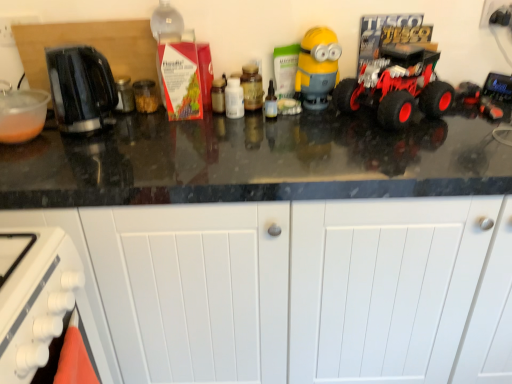
The image size is (512, 384). I want to click on free spot below black plastic toaster at left (from a real-world perspective), so pyautogui.click(x=105, y=131).